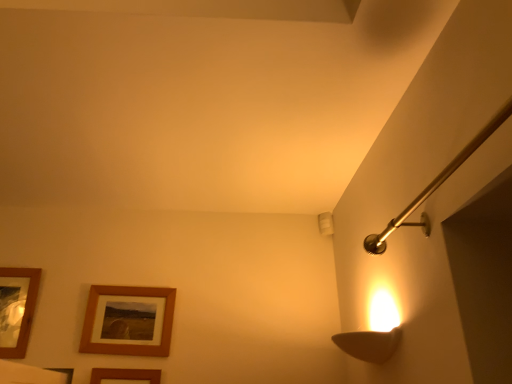
Question: Visually, is wooden framed picture at lower left, which ranks as the 3th picture frame in right-to-left order, positioned to the left or to the right of brown wooden picture frame at lower left, marked as the third picture frame in a left-to-right arrangement?

Choices:
 (A) right
 (B) left

Answer: (B)

Question: Looking at the image, does wooden framed picture at lower left, placed as the first picture frame when sorted from left to right, seem bigger or smaller compared to brown wooden picture frame at lower left, which appears as the first picture frame when viewed from the right?

Choices:
 (A) big
 (B) small

Answer: (A)

Question: Which object is the closest to the woodenobject at lower left, arranged as the second picture frame when viewed from the right?

Choices:
 (A) wooden framed picture at lower left, placed as the first picture frame when sorted from left to right
 (B) brown wooden picture frame at lower left, which appears as the first picture frame when viewed from the right

Answer: (B)

Question: Which object is positioned closest to the brown wooden picture frame at lower left, which appears as the first picture frame when viewed from the right?

Choices:
 (A) woodenobject at lower left, placed as the 2th picture frame when sorted from left to right
 (B) wooden framed picture at lower left, placed as the first picture frame when sorted from left to right

Answer: (A)